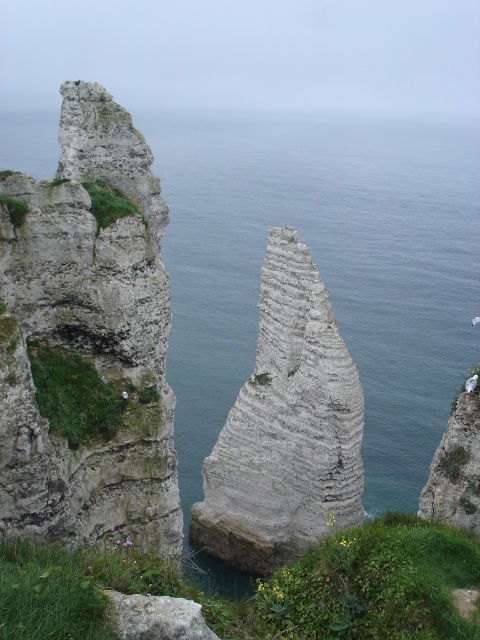
Question: Among these objects, which one is nearest to the camera?

Choices:
 (A) white rough rock at left
 (B) blue water at center

Answer: (A)

Question: Is white rough rock at left bigger than gray rough rock at lower center?

Choices:
 (A) yes
 (B) no

Answer: (A)

Question: Does blue water at center have a larger size compared to white rough rock at left?

Choices:
 (A) no
 (B) yes

Answer: (B)

Question: Which object is closer to the camera taking this photo?

Choices:
 (A) gray stone rock at center
 (B) gray rough rock at lower center

Answer: (B)

Question: Does gray stone rock at center have a smaller size compared to gray rough rock at lower center?

Choices:
 (A) yes
 (B) no

Answer: (B)

Question: Which of these objects is positioned closest to the white rough rock at left?

Choices:
 (A) gray stone rock at center
 (B) blue water at center
 (C) gray rough rock at lower center

Answer: (C)